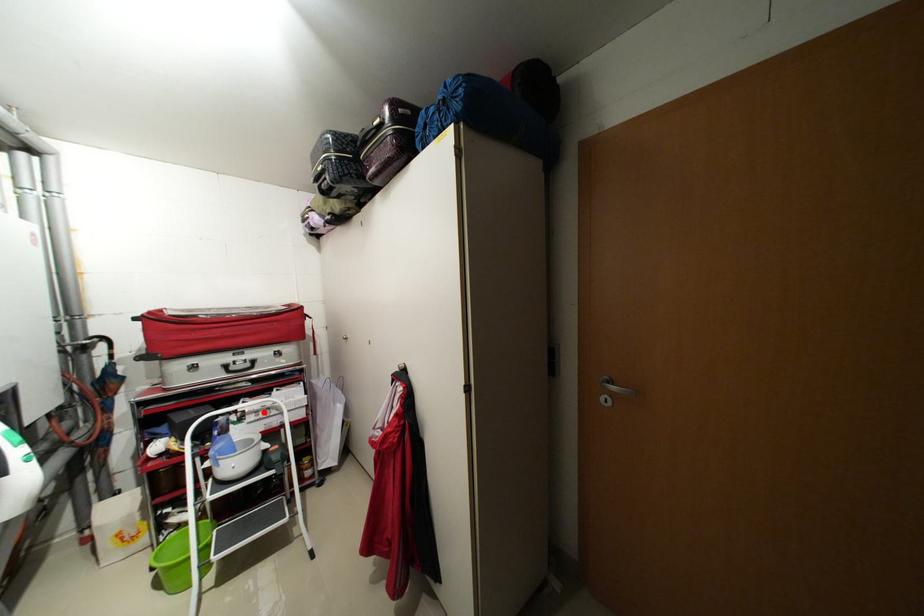
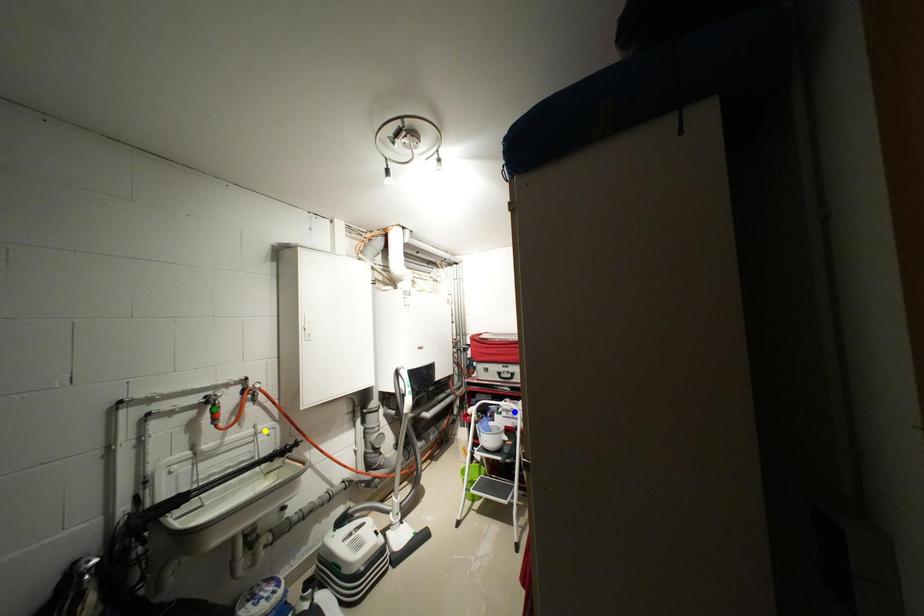
Question: I am providing you with two images of the same scene from different viewpoints. A red point is marked on the first image. You are given multiple points on the second image. Can you choose the point in image 2 that corresponds to the point in image 1?

Choices:
 (A) blue point
 (B) yellow point
 (C) green point

Answer: (A)